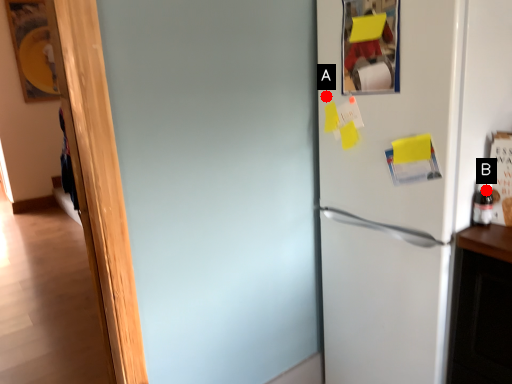
Question: Two points are circled on the image, labeled by A and B beside each circle. Which point is further to the camera?

Choices:
 (A) A is further
 (B) B is further

Answer: (A)